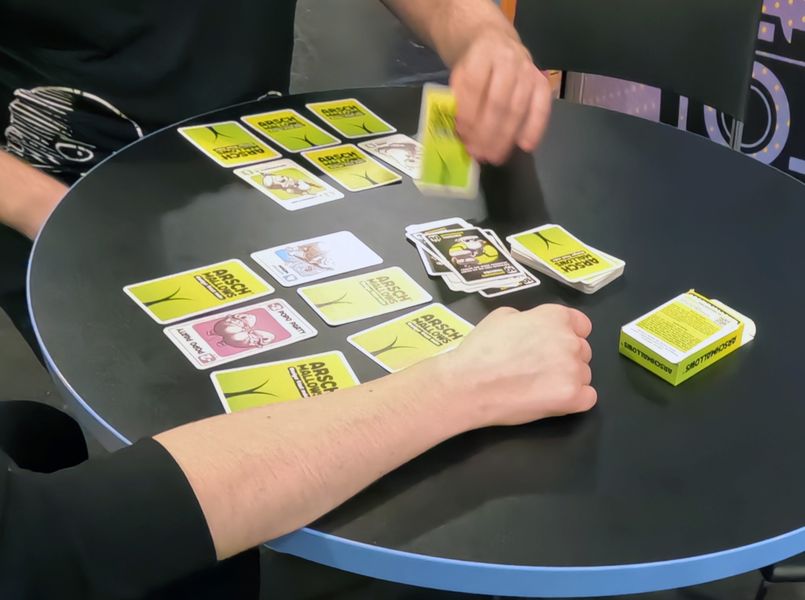
You are a GUI agent. You are given a task and a screenshot of the screen. Output one action in this format:
    pyautogui.click(x=<x>, y=<y>)
    Task: Click on the box for cards
    This screenshot has width=805, height=600.
    Given the screenshot: What is the action you would take?
    pyautogui.click(x=716, y=342)